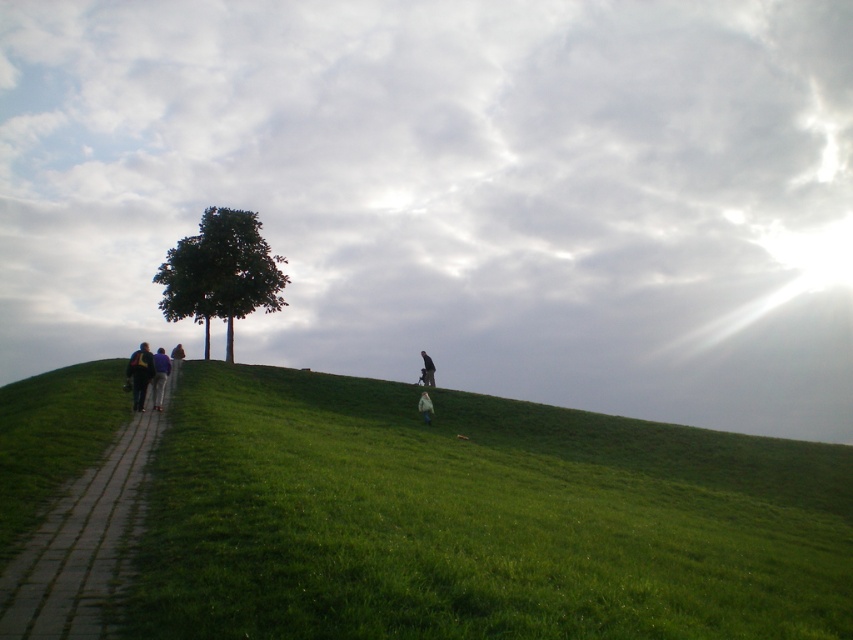
Between point (430, 371) and point (425, 410), which one is positioned in front?

Point (425, 410) is more forward.

Is point (432, 364) positioned behind point (430, 401)?

Yes, it is.

Describe the element at coordinates (427, 369) in the screenshot. Image resolution: width=853 pixels, height=640 pixels. I see `dark gray jacket at lower center` at that location.

At what (x,y) coordinates should I click in order to perform the action: click on dark gray jacket at lower center. Please return your answer as a coordinate pair (x, y). Image resolution: width=853 pixels, height=640 pixels. Looking at the image, I should click on (427, 369).

Can you confirm if white fleece jacket at center is taller than light brown leather jacket at lower left?

Indeed, white fleece jacket at center has a greater height compared to light brown leather jacket at lower left.

Measure the distance between white fleece jacket at center and light brown leather jacket at lower left.

A distance of 21.03 meters exists between white fleece jacket at center and light brown leather jacket at lower left.

Identify the location of white fleece jacket at center. (424, 406).

The image size is (853, 640). Find the location of `white fleece jacket at center`. white fleece jacket at center is located at coordinates (424, 406).

Which is behind, point (177, 308) or point (137, 392)?

The point (177, 308) is more distant.

Between green leafy tree at center and dark blue jeans at left, which one has less height?

Standing shorter between the two is dark blue jeans at left.

At what (x,y) coordinates should I click in order to perform the action: click on green leafy tree at center. Please return your answer as a coordinate pair (x, y). This screenshot has width=853, height=640. Looking at the image, I should click on (219, 273).